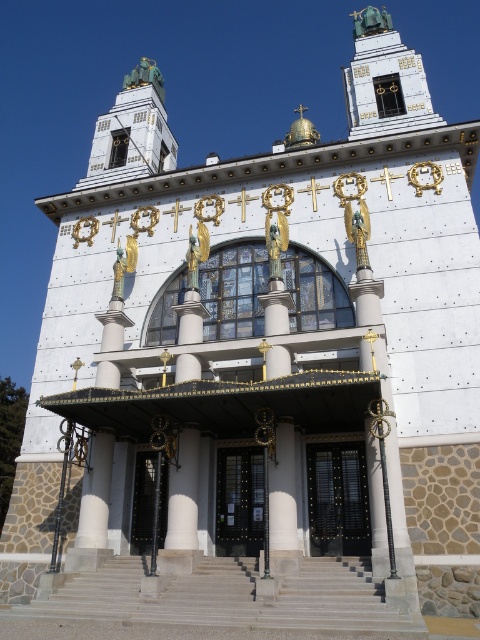
Question: Which object appears closest to the camera in this image?

Choices:
 (A) white stone pillar at center
 (B) black glass door at center
 (C) polished bronze spire at upper center
 (D) gray concrete stairs at center

Answer: (D)

Question: Does black metal gate at center come behind black metal door at center?

Choices:
 (A) yes
 (B) no

Answer: (B)

Question: Which is nearer to the black glass door at center?

Choices:
 (A) polished bronze spire at upper center
 (B) black metal door at center
 (C) white stone pillar at center
 (D) black metal gate at center

Answer: (B)

Question: Does black metal door at center have a smaller size compared to black glass door at center?

Choices:
 (A) yes
 (B) no

Answer: (A)

Question: Which object is closer to the camera taking this photo?

Choices:
 (A) polished bronze spire at upper center
 (B) black metal gate at center
 (C) white stone pillar at center

Answer: (C)

Question: Can you confirm if polished bronze spire at upper center is positioned to the left of black metal gate at center?

Choices:
 (A) yes
 (B) no

Answer: (B)